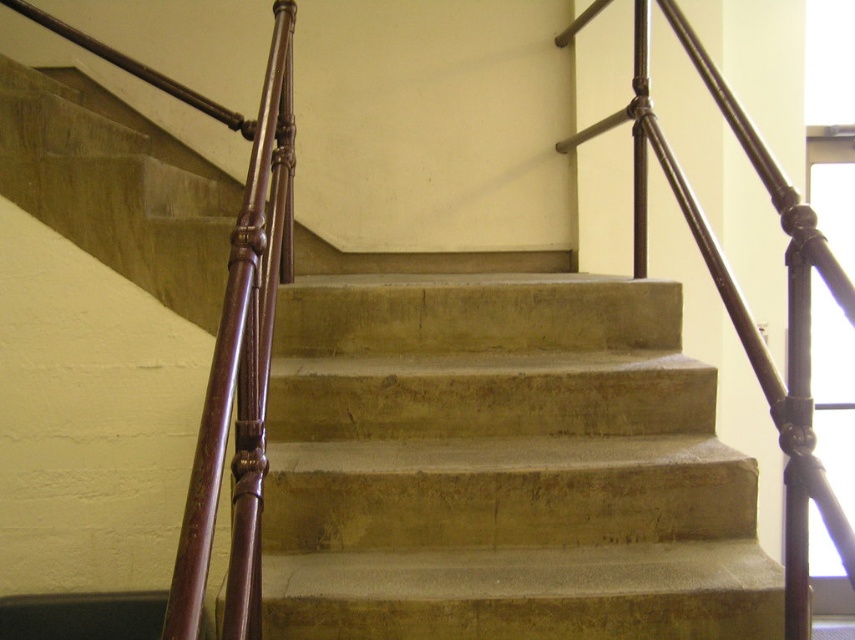
Can you confirm if concrete stairs at center is positioned to the left of polished dark brown metal railing at upper right?

Correct, you'll find concrete stairs at center to the left of polished dark brown metal railing at upper right.

Which is more to the right, concrete stairs at center or polished dark brown metal railing at upper right?

From the viewer's perspective, polished dark brown metal railing at upper right appears more on the right side.

Who is more distant from viewer, (339, 323) or (852, 531)?

The point (339, 323) is behind.

Where is `concrete stairs at center`? Image resolution: width=855 pixels, height=640 pixels. concrete stairs at center is located at coordinates (502, 467).